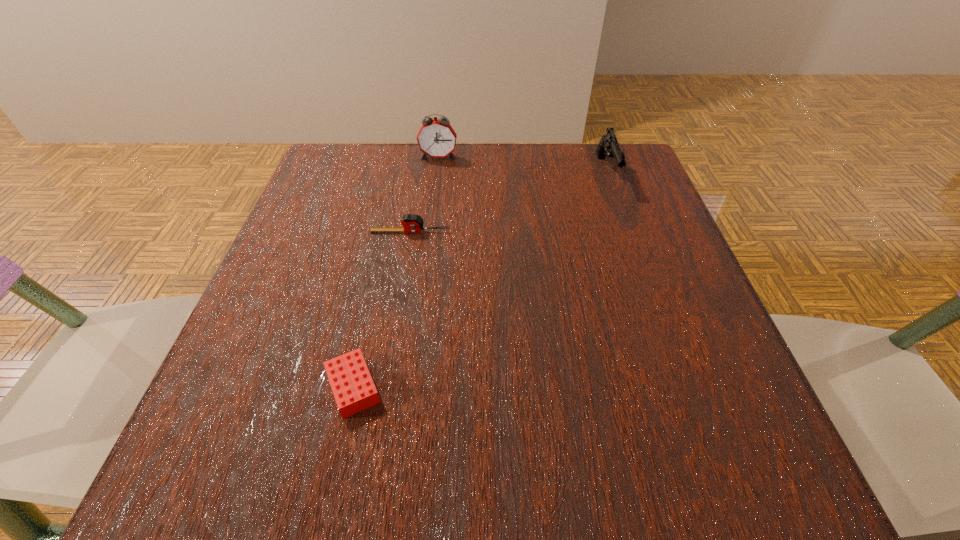
This screenshot has height=540, width=960. I want to click on vacant region at the far left corner of the desktop, so click(x=335, y=157).

Where is `blank area at the far right corner`? Image resolution: width=960 pixels, height=540 pixels. blank area at the far right corner is located at coordinates (578, 150).

Where is `vacant space at the near right corner of the desktop`? Image resolution: width=960 pixels, height=540 pixels. vacant space at the near right corner of the desktop is located at coordinates (773, 488).

The width and height of the screenshot is (960, 540). I want to click on blank region between the Lego and the second nearest object, so click(x=382, y=309).

Identify the location of unoccupied position between the second nearest object and the nearest object. The height and width of the screenshot is (540, 960). (382, 309).

The height and width of the screenshot is (540, 960). I want to click on free spot between the nearest object and the rightmost object, so click(x=480, y=280).

Find the location of `free spot between the shortest object and the third farthest object`. free spot between the shortest object and the third farthest object is located at coordinates (382, 309).

Find the location of a particular element. The width and height of the screenshot is (960, 540). vacant area between the Lego and the second nearest object is located at coordinates (382, 309).

The width and height of the screenshot is (960, 540). Identify the location of vacant area between the tallest object and the second nearest object. (424, 194).

At what (x,y) coordinates should I click in order to perform the action: click on free space between the gun and the alarm clock. Please return your answer as a coordinate pair (x, y). Looking at the image, I should click on (522, 165).